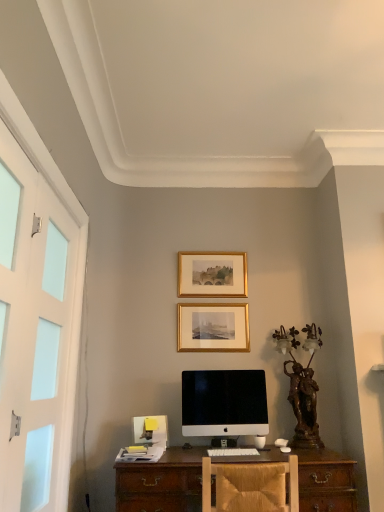
You are a GUI agent. You are given a task and a screenshot of the screen. Output one action in this format:
    pyautogui.click(x=<x>, y=<y>)
    Task: Click on the free space above gold/gilded picture frame at upper center, the 1th picture frame positioned from the top (from a real-world perspective)
    The image size is (384, 512).
    Given the screenshot: What is the action you would take?
    pyautogui.click(x=220, y=246)